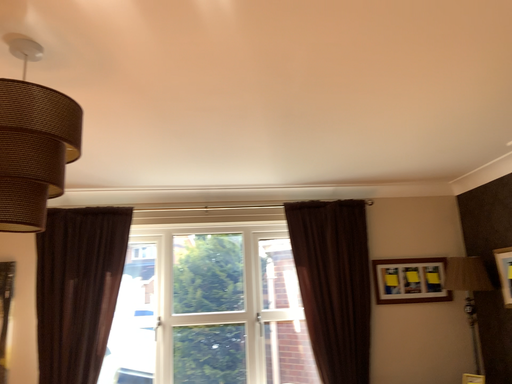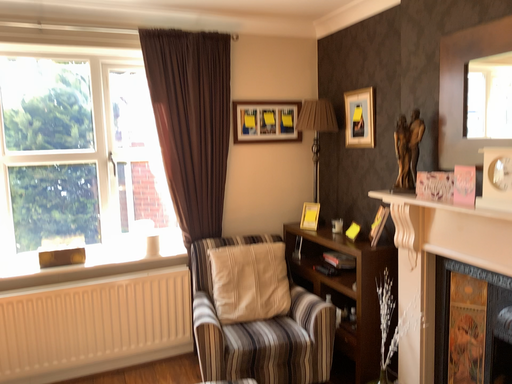
Question: Which way did the camera rotate in the video?

Choices:
 (A) rotated upward
 (B) rotated downward

Answer: (B)